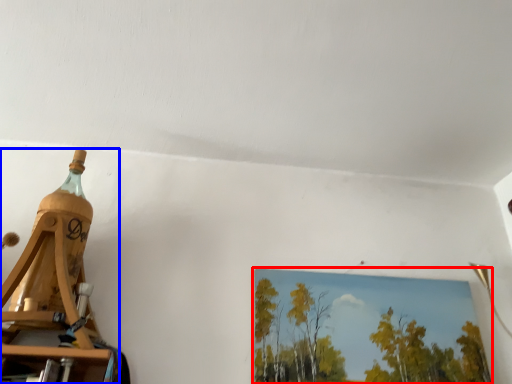
Question: Which object is closer to the camera taking this photo, picture frame (highlighted by a red box) or bottle (highlighted by a blue box)?

Choices:
 (A) picture frame
 (B) bottle

Answer: (B)